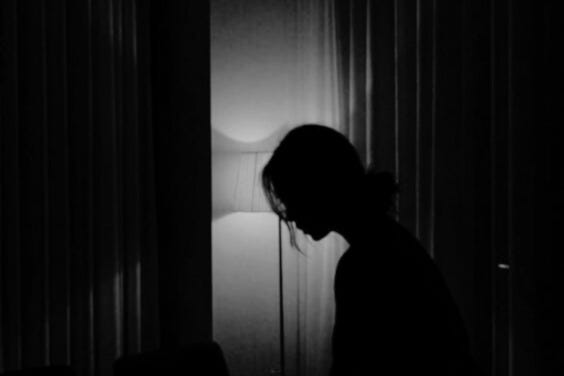
Where is `wall`? wall is located at coordinates (259, 71).